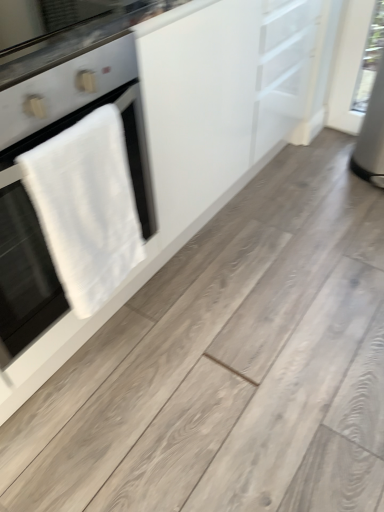
Question: Is point (29, 275) positioned closer to the camera than point (8, 67)?

Choices:
 (A) closer
 (B) farther

Answer: (B)

Question: From a real-world perspective, is white towel at left above or below black glass countertop at upper left?

Choices:
 (A) below
 (B) above

Answer: (A)

Question: Estimate the real-world distances between objects in this image. Which object is farther from the white matte cabinet at upper left?

Choices:
 (A) black glass countertop at upper left
 (B) white towel at left

Answer: (A)

Question: Which object is positioned farthest from the white towel at left?

Choices:
 (A) black glass countertop at upper left
 (B) white matte cabinet at upper left

Answer: (B)